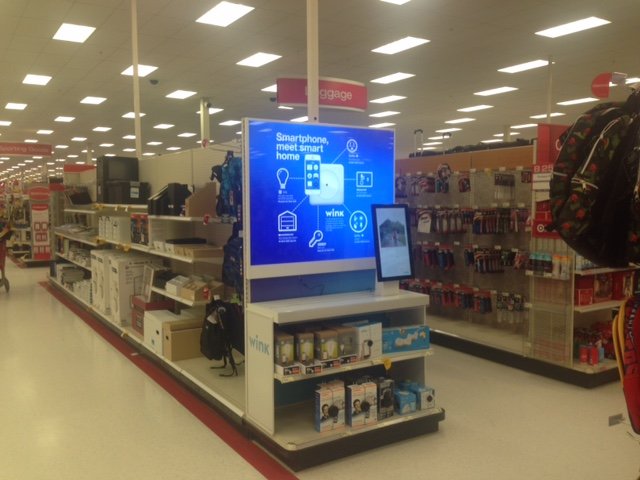
Identify the location of boxed supplies. This screenshot has height=480, width=640. (113, 231), (112, 268), (178, 246), (164, 329).